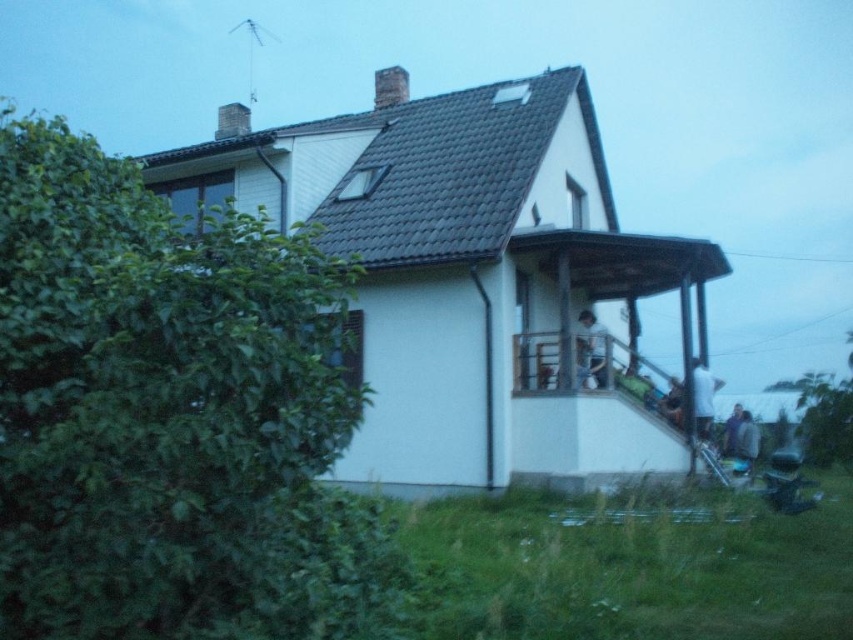
Does white matte shirt at right have a lesser width compared to white fabric shirt at upper center?

In fact, white matte shirt at right might be wider than white fabric shirt at upper center.

Describe the element at coordinates (703, 397) in the screenshot. The image size is (853, 640). I see `white matte shirt at right` at that location.

What are the coordinates of `white matte shirt at right` in the screenshot? It's located at (703, 397).

Who is positioned more to the left, light brown leather jacket at lower right or smooth brown hair at upper right?

smooth brown hair at upper right

What do you see at coordinates (746, 444) in the screenshot? I see `light brown leather jacket at lower right` at bounding box center [746, 444].

Find the location of `light brown leather jacket at lower right`. light brown leather jacket at lower right is located at coordinates (746, 444).

Which of these two, white matte shirt at right or blue denim jeans at lower right, stands taller?

white matte shirt at right

Is white matte shirt at right thinner than blue denim jeans at lower right?

Yes.

Is point (709, 381) closer to camera compared to point (735, 429)?

That is True.

Locate an element on the screen. This screenshot has height=640, width=853. white matte shirt at right is located at coordinates (703, 397).